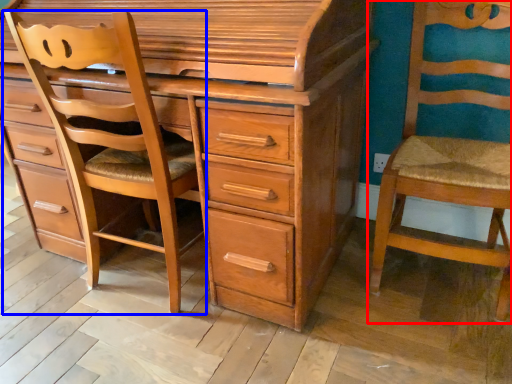
Question: Which of the following is the closest to the observer, chair (highlighted by a red box) or furniture (highlighted by a blue box)?

Choices:
 (A) chair
 (B) furniture

Answer: (A)